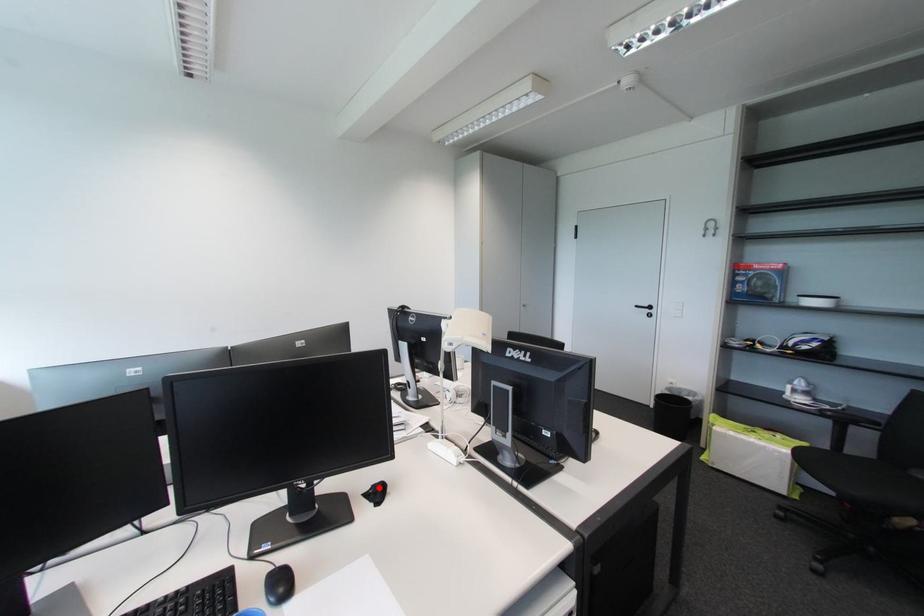
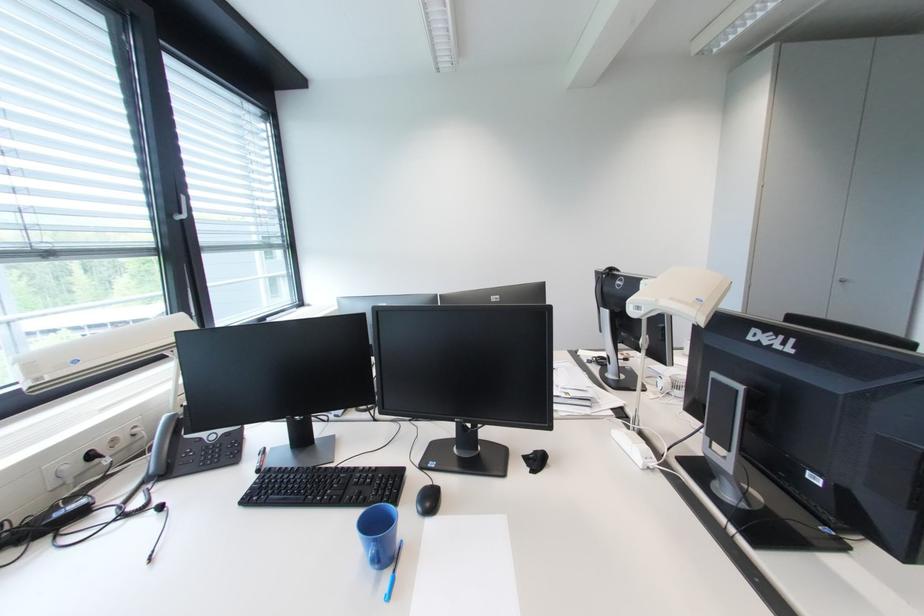
The point at the highlighted location is marked in the first image. Where is the corresponding point in the second image?

(541, 454)